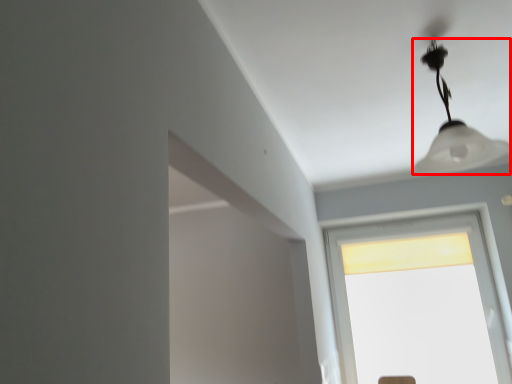
Question: Observing the image, what is the correct spatial positioning of lamp (annotated by the red box) in reference to window?

Choices:
 (A) right
 (B) left

Answer: (B)